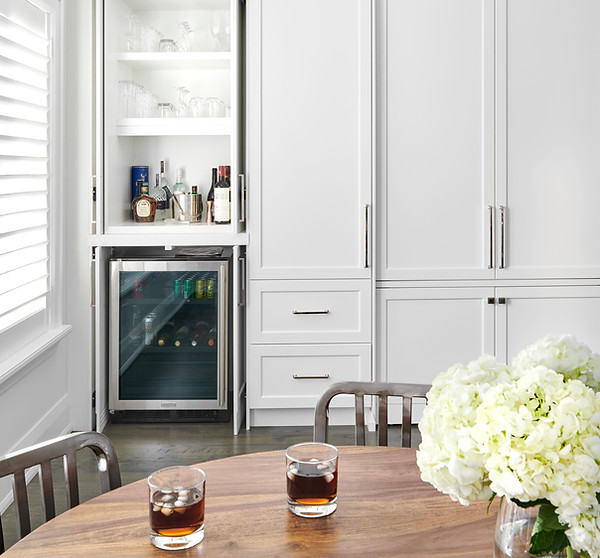
Where is `window`? This screenshot has height=558, width=600. window is located at coordinates (16, 296).